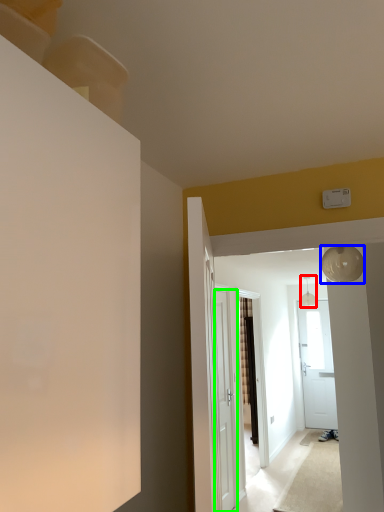
Question: Which object is the farthest from light fixture (highlighted by a red box)? Choose among these: lamp (highlighted by a blue box) or door (highlighted by a green box).

Choices:
 (A) lamp
 (B) door

Answer: (A)